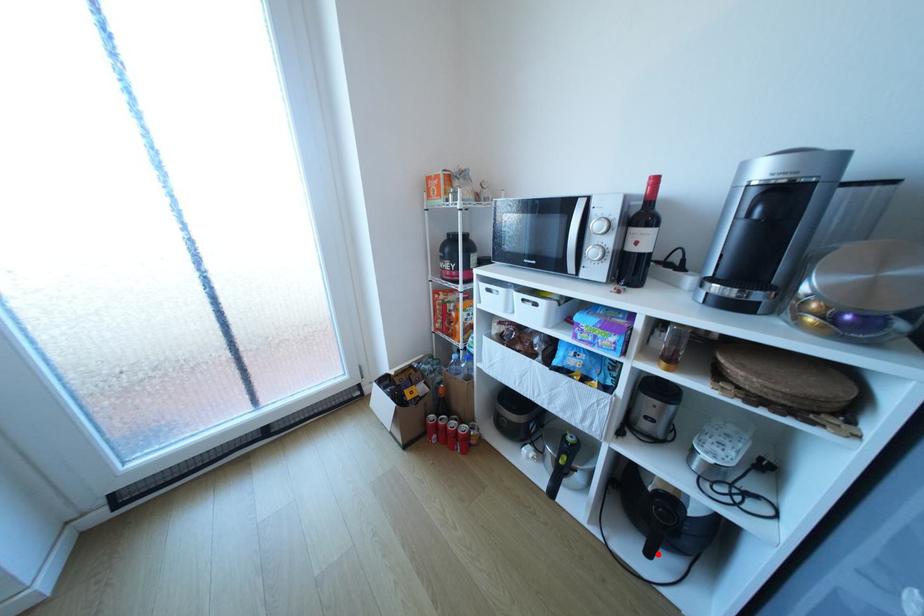
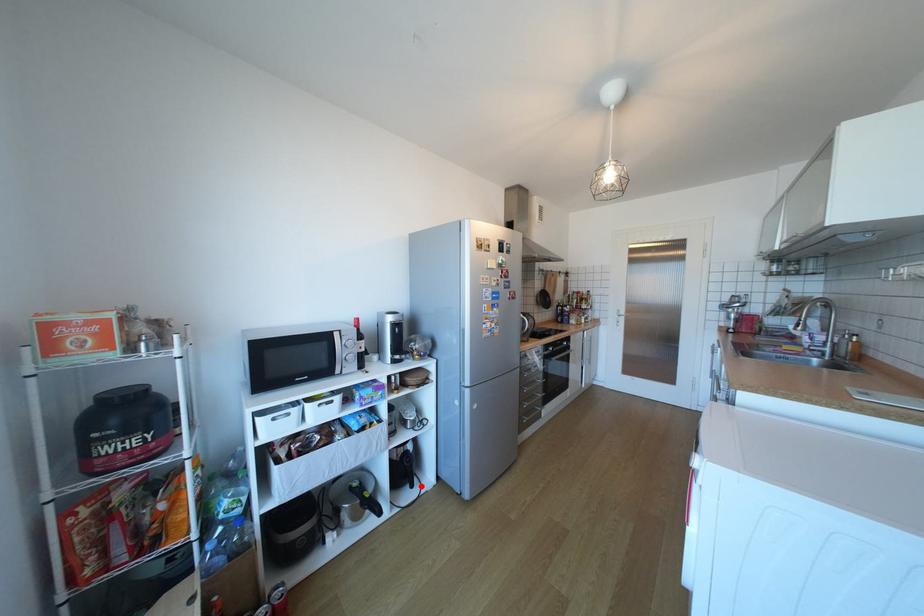
I am providing you with two images of the same scene from different viewpoints. A red point is marked on the first image and another point is marked on the second image. Does the point marked in image1 correspond to the same location as the one in image2?

Yes